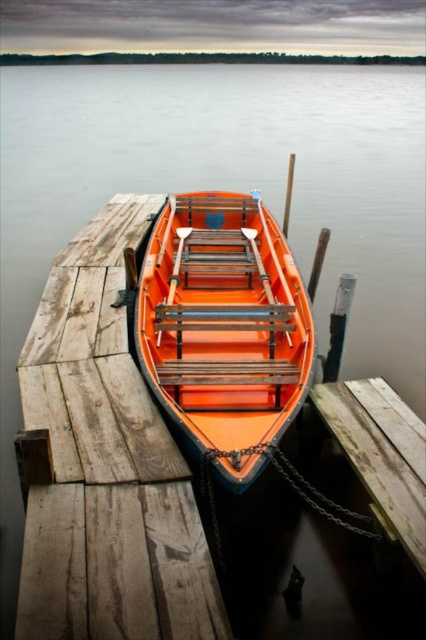
You are standing at the wooden dock at center and want to take a photo of the vibrant orange rowboat. If your camera is 4.19 meters away from the dock, will you be able to capture the entire boat in the frame?

The wooden dock at center and camera are 4.19 meters apart from each other. Since the camera is positioned at this distance, it should be possible to capture the entire boat in the frame as long as the camera lens has an appropriate angle of view.